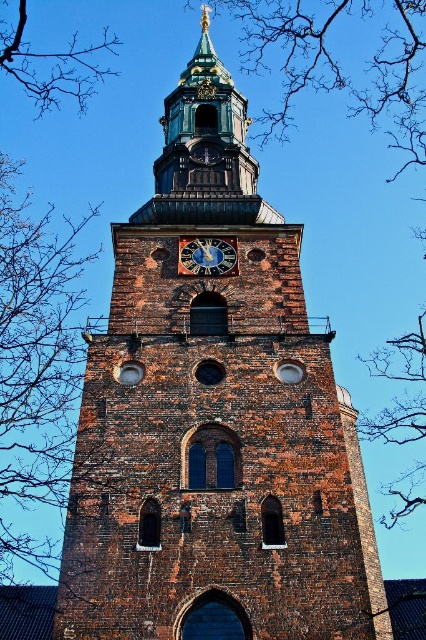
Question: Which object is the farthest from the bare branches at left?

Choices:
 (A) bare branches at upper left
 (B) blue painted metal clock at center

Answer: (B)

Question: Which is farther from the bare branches at left?

Choices:
 (A) bare branches at upper left
 (B) blue painted metal clock at center

Answer: (B)

Question: Can you confirm if bare branches at upper left is bigger than blue painted metal clock at center?

Choices:
 (A) no
 (B) yes

Answer: (B)

Question: Is bare branches at upper left bigger than blue painted metal clock at center?

Choices:
 (A) yes
 (B) no

Answer: (A)

Question: Where is bare branches at left located in relation to blue painted metal clock at center in the image?

Choices:
 (A) above
 (B) below

Answer: (B)

Question: Considering the real-world distances, which object is farthest from the bare branches at upper left?

Choices:
 (A) bare branches at left
 (B) blue painted metal clock at center

Answer: (B)